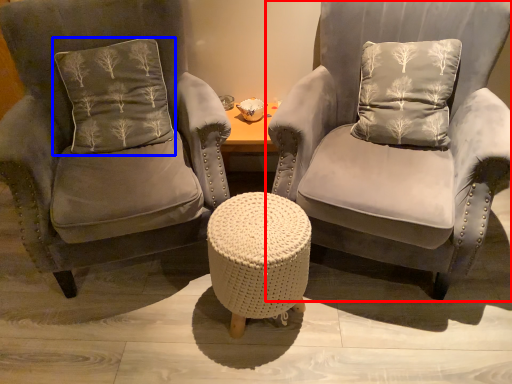
Question: Among these objects, which one is farthest to the camera, chair (highlighted by a red box) or pillow (highlighted by a blue box)?

Choices:
 (A) chair
 (B) pillow

Answer: (B)